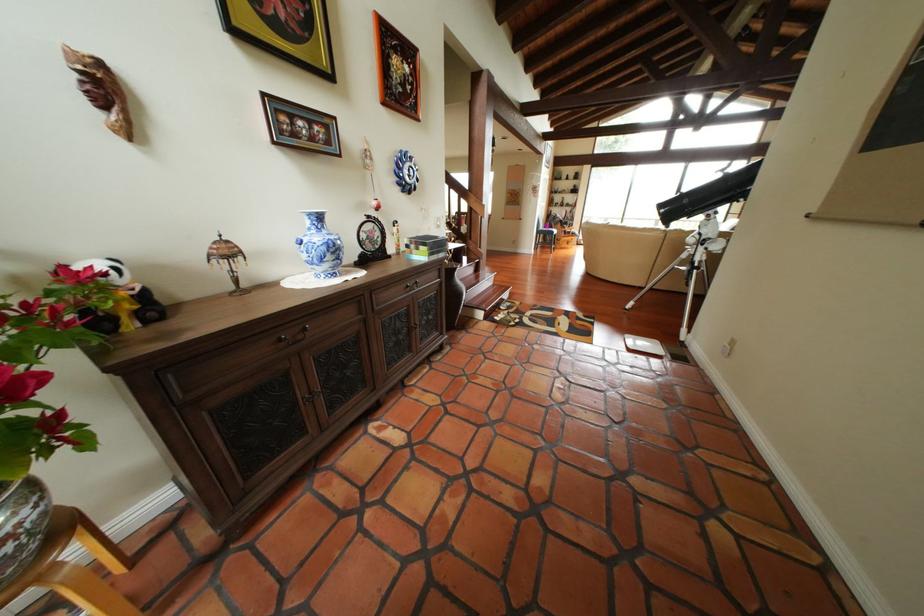
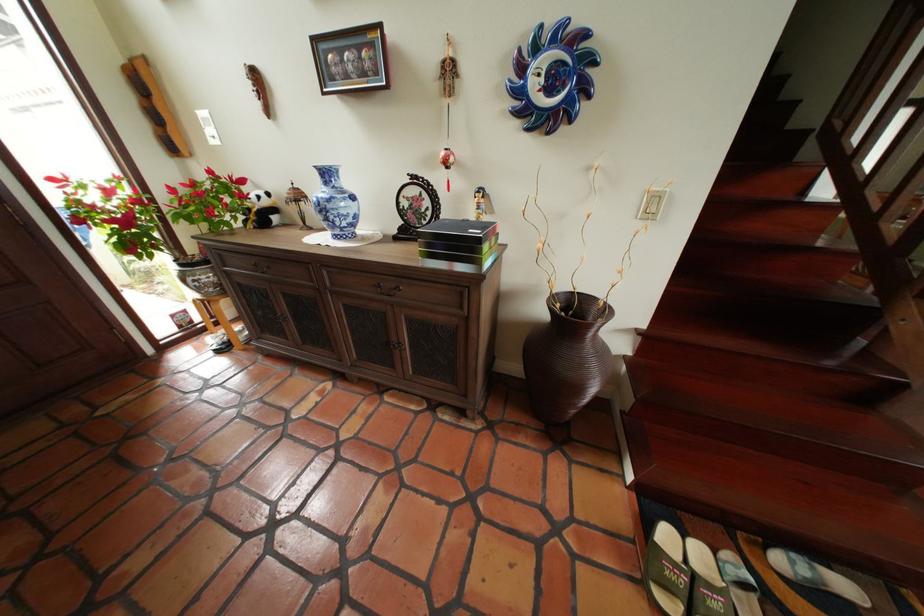
Find the pixel in the second image that matches point (518, 328) in the first image.

(651, 578)